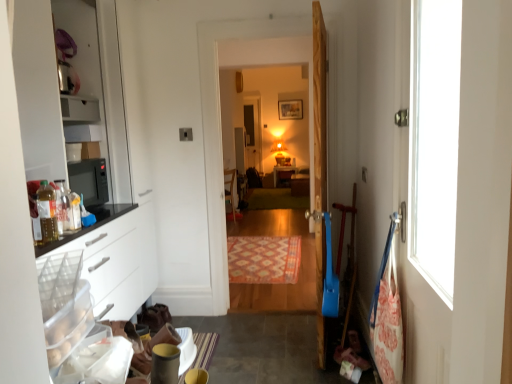
Question: Is green carpet at center, which is the 2th mat from bottom to top, outside patterned carpet at center, which appears as the 2th mat when viewed from the top?

Choices:
 (A) no
 (B) yes

Answer: (B)

Question: Is green carpet at center, which is the first mat in top-to-bottom order, wider than patterned carpet at center, the 1th mat in the front-to-back sequence?

Choices:
 (A) yes
 (B) no

Answer: (B)

Question: Is patterned carpet at center, which is the 1th mat from bottom to top, inside green carpet at center, the 1th mat positioned from the back?

Choices:
 (A) no
 (B) yes

Answer: (A)

Question: Is green carpet at center, the 1th mat positioned from the back, smaller than patterned carpet at center, which is the 1th mat from bottom to top?

Choices:
 (A) no
 (B) yes

Answer: (A)

Question: Is green carpet at center, which is the 2th mat from bottom to top, next to patterned carpet at center, which appears as the 2th mat when viewed from the top, and touching it?

Choices:
 (A) yes
 (B) no

Answer: (B)

Question: Does green carpet at center, which is the first mat in top-to-bottom order, lie in front of patterned carpet at center, which appears as the 2th mat when viewed from the top?

Choices:
 (A) yes
 (B) no

Answer: (B)

Question: Is green carpet at center, which is the first mat in top-to-bottom order, facing away from matte yellow concrete at lower left?

Choices:
 (A) no
 (B) yes

Answer: (A)

Question: Could you tell me if green carpet at center, which is the 2th mat from bottom to top, is facing matte yellow concrete at lower left?

Choices:
 (A) yes
 (B) no

Answer: (B)

Question: Is green carpet at center, which is the 2th mat from bottom to top, positioned in front of matte yellow concrete at lower left?

Choices:
 (A) yes
 (B) no

Answer: (B)

Question: Is green carpet at center, which is the 2th mat from bottom to top, positioned beyond the bounds of matte yellow concrete at lower left?

Choices:
 (A) yes
 (B) no

Answer: (A)

Question: Can you confirm if green carpet at center, which is the first mat in top-to-bottom order, is smaller than matte yellow concrete at lower left?

Choices:
 (A) no
 (B) yes

Answer: (A)

Question: From a real-world perspective, is green carpet at center, which is the 2th mat from front to back, located higher than matte yellow concrete at lower left?

Choices:
 (A) yes
 (B) no

Answer: (A)

Question: Is translucent plastic bottle at left positioned behind matte yellow concrete at lower left?

Choices:
 (A) yes
 (B) no

Answer: (B)